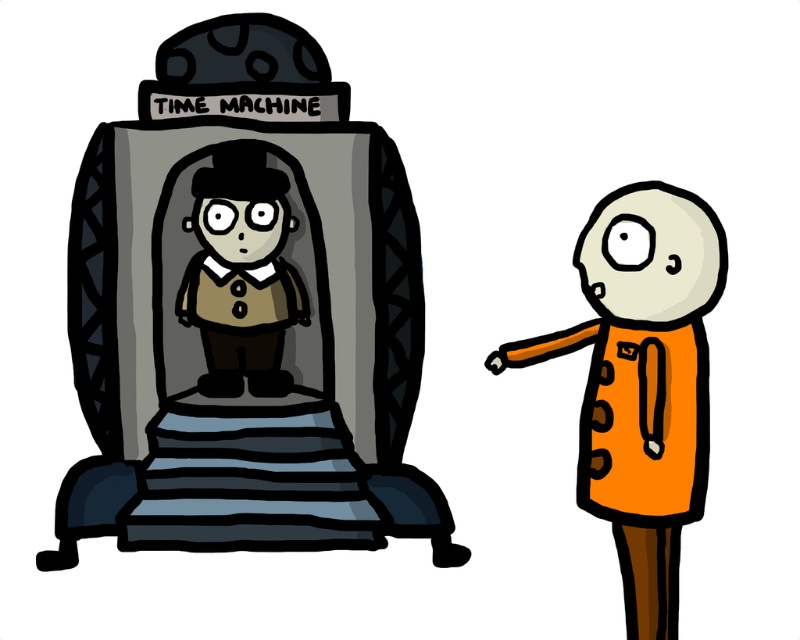
Can you confirm if matte gray time machine at center is thinner than orange fabric coat at right?

No, matte gray time machine at center is not thinner than orange fabric coat at right.

Between point (144, 291) and point (628, 404), which one is positioned behind?

The point (628, 404) is more distant.

Image resolution: width=800 pixels, height=640 pixels. What are the coordinates of `matte gray time machine at center` in the screenshot? It's located at (246, 316).

At what (x,y) coordinates should I click in order to perform the action: click on matte gray time machine at center. Please return your answer as a coordinate pair (x, y). The height and width of the screenshot is (640, 800). Looking at the image, I should click on (246, 316).

Does matte gray time machine at center have a lesser height compared to matte brown suit at center?

In fact, matte gray time machine at center may be taller than matte brown suit at center.

Between point (341, 84) and point (206, 275), which one is positioned in front?

Point (341, 84) is more forward.

Does point (144, 282) lie in front of point (260, 310)?

Yes, point (144, 282) is in front of point (260, 310).

Where is `matte gray time machine at center`? The image size is (800, 640). matte gray time machine at center is located at coordinates (246, 316).

Does orange fabric coat at right have a greater height compared to matte brown suit at center?

Yes.

Is orange fabric coat at right smaller than matte brown suit at center?

Incorrect, orange fabric coat at right is not smaller in size than matte brown suit at center.

You are a GUI agent. You are given a task and a screenshot of the screen. Output one action in this format:
    pyautogui.click(x=<x>, y=<y>)
    Task: Click on the orange fabric coat at right
    The width and height of the screenshot is (800, 640).
    Given the screenshot: What is the action you would take?
    pyautogui.click(x=642, y=381)